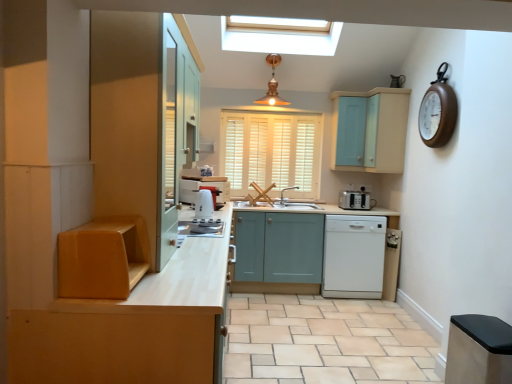
Where is `vacant space underneath wooden clock at upper right (from a real-world perspective)`? The width and height of the screenshot is (512, 384). vacant space underneath wooden clock at upper right (from a real-world perspective) is located at coordinates (417, 329).